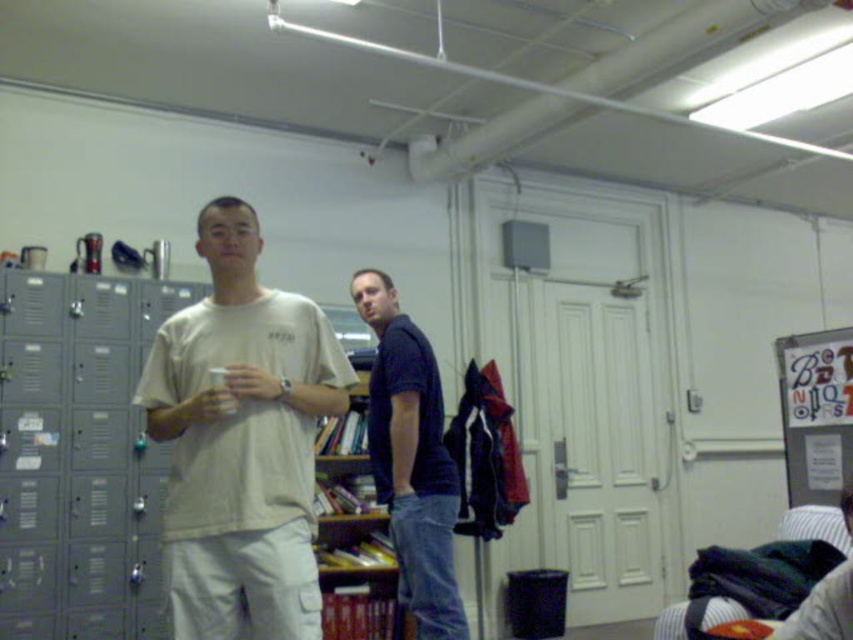
Question: Which point appears farthest from the camera in this image?

Choices:
 (A) (415, 419)
 (B) (322, 337)
 (C) (350, 614)

Answer: (C)

Question: Is dark blue shirt at center thinner than wooden bookshelf at center?

Choices:
 (A) yes
 (B) no

Answer: (A)

Question: Can you confirm if dark blue shirt at center is positioned above wooden bookshelf at center?

Choices:
 (A) no
 (B) yes

Answer: (B)

Question: Which point is closer to the camera?

Choices:
 (A) (403, 598)
 (B) (352, 452)
 (C) (192, 634)

Answer: (C)

Question: Is light beige cotton t-shirt at center above wooden bookshelf at center?

Choices:
 (A) no
 (B) yes

Answer: (B)

Question: Among these objects, which one is nearest to the camera?

Choices:
 (A) wooden bookshelf at center
 (B) light beige cotton t-shirt at center
 (C) dark blue shirt at center

Answer: (B)